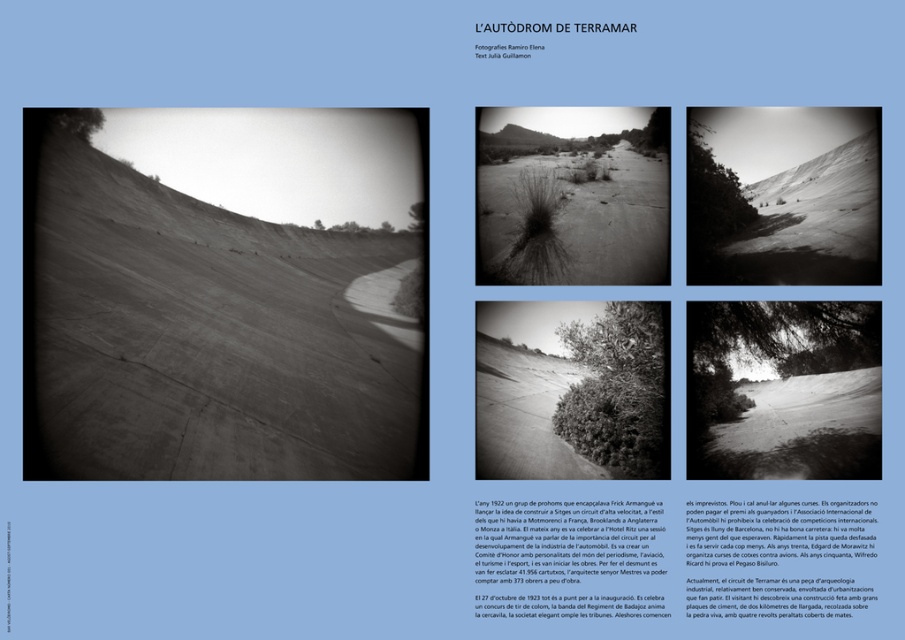
You are a photographer planning to capture the landscape of the smooth sand hill at left and the smooth sand dune at center. Which of the two has a taller elevation?

The smooth sand hill at left has a greater height compared to the smooth sand dune at center, so it is taller in elevation.

You are standing at point (x=783, y=195) in the image of L AUTDROM DE TERRAMAR. What is the terrain like at this location?

The terrain at point (x=783, y=195) is a smooth sand dune at center.